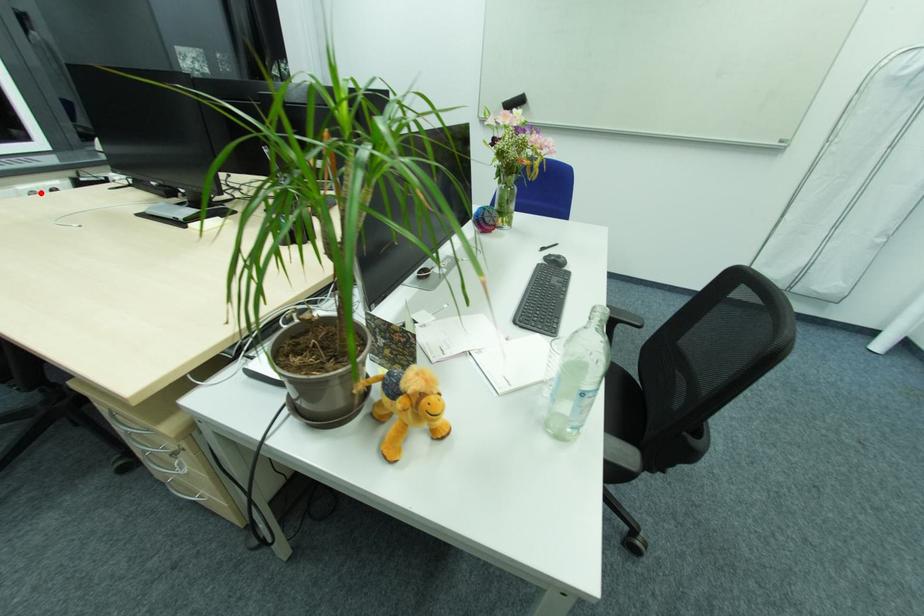
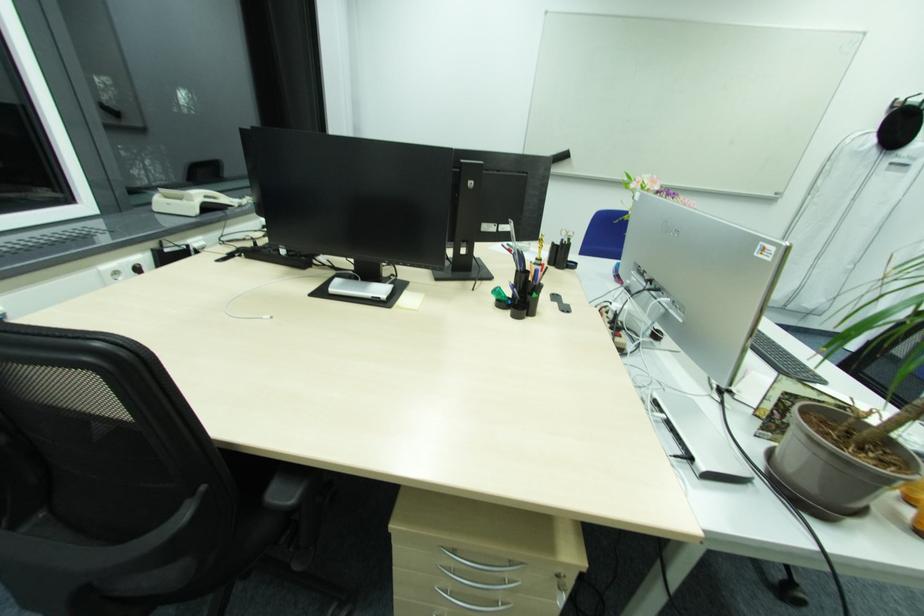
The point at the highlighted location is marked in the first image. Where is the corresponding point in the second image?

(120, 272)